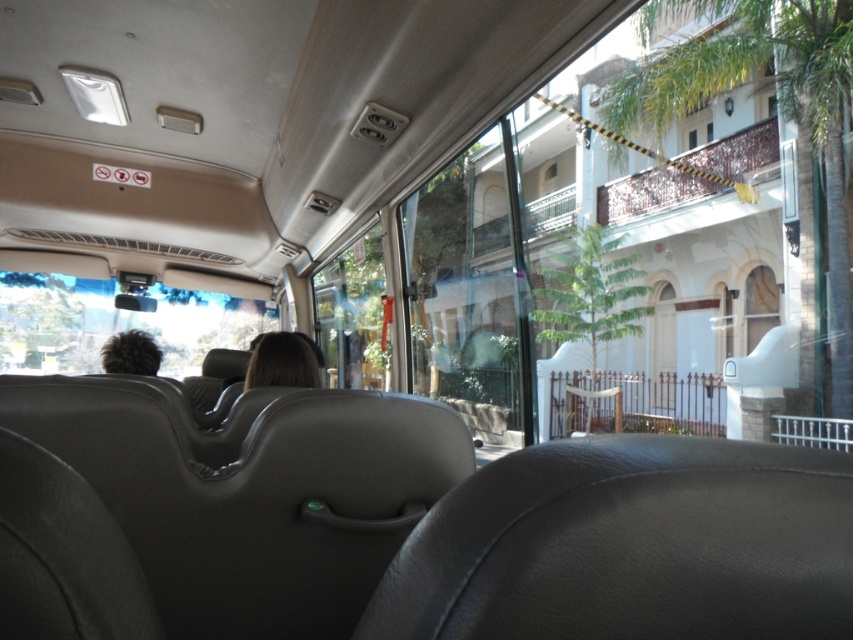
Question: Is transparent plastic window at upper left to the left of dark brown hair at left from the viewer's perspective?

Choices:
 (A) yes
 (B) no

Answer: (A)

Question: Observing the image, what is the correct spatial positioning of transparent plastic window at upper left in reference to brown hair at center?

Choices:
 (A) right
 (B) left

Answer: (B)

Question: Which object is the closest to the transparent plastic window at upper left?

Choices:
 (A) dark brown hair at left
 (B) brown hair at center

Answer: (A)

Question: Is transparent plastic window at upper left wider than brown hair at center?

Choices:
 (A) yes
 (B) no

Answer: (A)

Question: Which object is positioned farthest from the brown hair at center?

Choices:
 (A) transparent plastic window at upper left
 (B) dark brown hair at left

Answer: (A)

Question: Which point is closer to the camera?

Choices:
 (A) (265, 323)
 (B) (271, 336)
 (C) (115, 348)

Answer: (B)